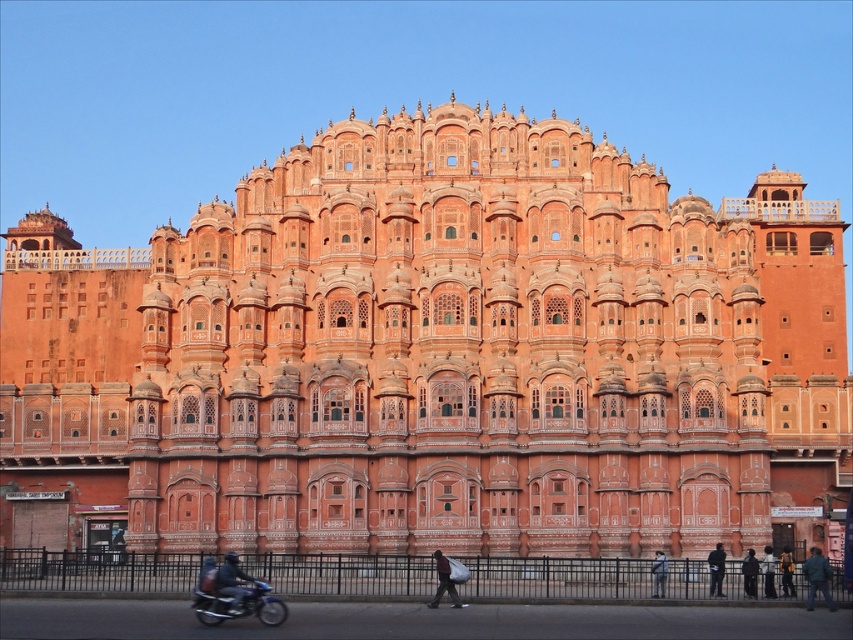
Question: Which point appears farthest from the camera in this image?

Choices:
 (A) (746, 577)
 (B) (428, 602)
 (C) (653, 589)
 (D) (827, 568)

Answer: (C)

Question: Is dark blue jeans at lower right positioned behind dark blue jeans at lower center?

Choices:
 (A) no
 (B) yes

Answer: (B)

Question: Which object is positioned closest to the dark blue jeans at lower center?

Choices:
 (A) dark gray fabric bag at center
 (B) dark blue jeans at lower right
 (C) dark blue fabric jacket at lower right

Answer: (C)

Question: Which object is positioned farthest from the dark blue jacket at lower right?

Choices:
 (A) shiny blue motorcycle at lower left
 (B) dark blue fabric jacket at lower right
 (C) dark blue jeans at lower center

Answer: (A)

Question: Is dark blue jacket at lower right further to the viewer compared to dark blue jeans at lower right?

Choices:
 (A) no
 (B) yes

Answer: (A)

Question: Is shiny blue motorcycle at lower left closer to camera compared to dark brown leather jacket at lower right?

Choices:
 (A) yes
 (B) no

Answer: (A)